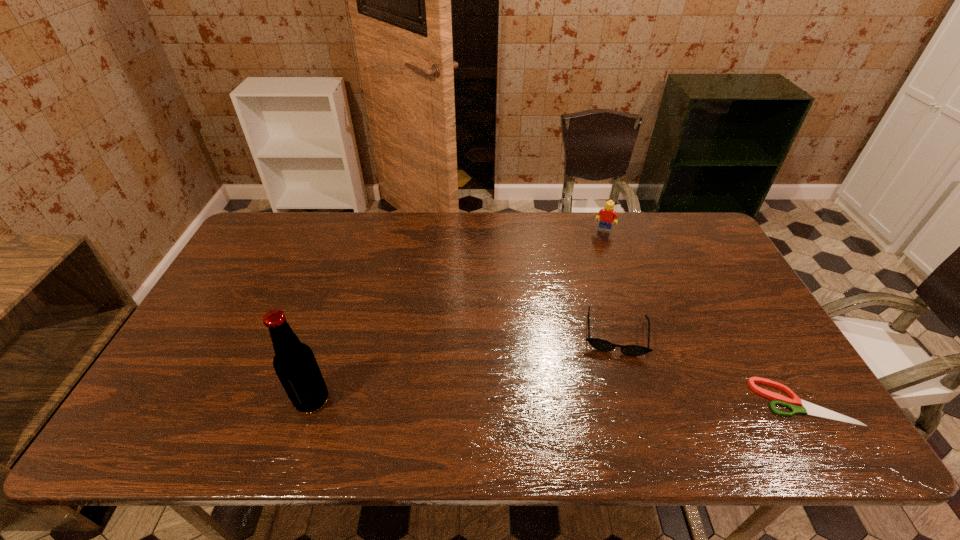
Locate an element on the screen. blank area in the image that satisfies the following two spatial constraints: 1. on the back side of the sunglasses; 2. on the left side of the leftmost object is located at coordinates (333, 333).

Find the location of `free spot that satisfies the following two spatial constraints: 1. on the back side of the farthest object; 2. on the right side of the beer bottle`. free spot that satisfies the following two spatial constraints: 1. on the back side of the farthest object; 2. on the right side of the beer bottle is located at coordinates (366, 230).